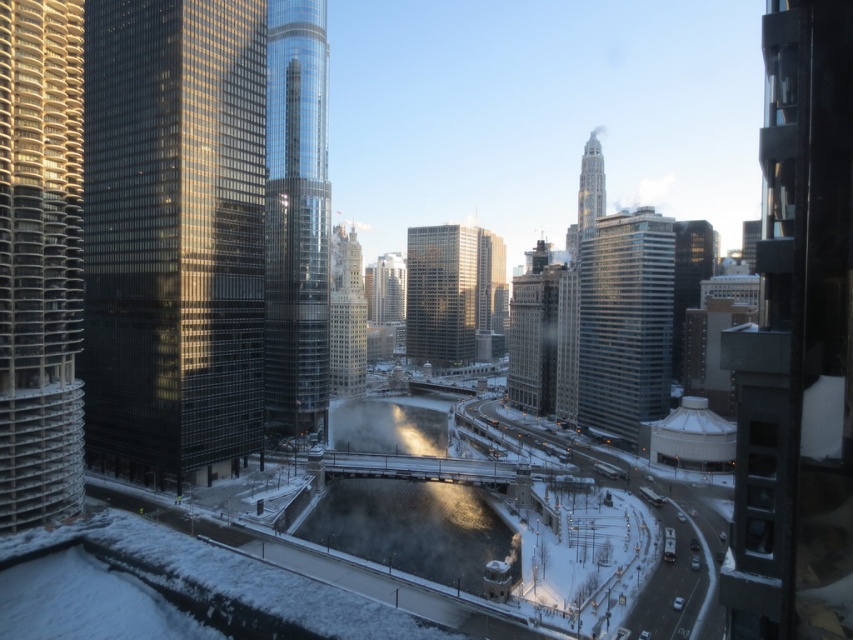
Can you confirm if shiny glass skyscraper at center is smaller than reflective glass skyscraper at center?

Yes, shiny glass skyscraper at center is smaller than reflective glass skyscraper at center.

This screenshot has width=853, height=640. What do you see at coordinates (296, 218) in the screenshot?
I see `shiny glass skyscraper at center` at bounding box center [296, 218].

Who is more distant from viewer, (x=283, y=344) or (x=489, y=305)?

The point (x=489, y=305) is behind.

The image size is (853, 640). Find the location of `shiny glass skyscraper at center`. shiny glass skyscraper at center is located at coordinates (296, 218).

In the scene shown: Which of these two, shiny glass skyscraper at center or silver glass skyscraper at center, stands shorter?

silver glass skyscraper at center is shorter.

Is shiny glass skyscraper at center positioned behind silver glass skyscraper at center?

No, it is in front of silver glass skyscraper at center.

Between point (318, 227) and point (339, 317), which one is positioned behind?

The point (339, 317) is more distant.

Find the location of `shiny glass skyscraper at center`. shiny glass skyscraper at center is located at coordinates (296, 218).

Does reflective glass skyscraper at center have a lesser height compared to silver glass skyscraper at center?

Yes, reflective glass skyscraper at center is shorter than silver glass skyscraper at center.

In order to click on reflective glass skyscraper at center in this screenshot , I will do `click(451, 291)`.

Does point (498, 289) lie behind point (339, 262)?

Yes, point (498, 289) is behind point (339, 262).

Where is `reflective glass skyscraper at center`? reflective glass skyscraper at center is located at coordinates (451, 291).